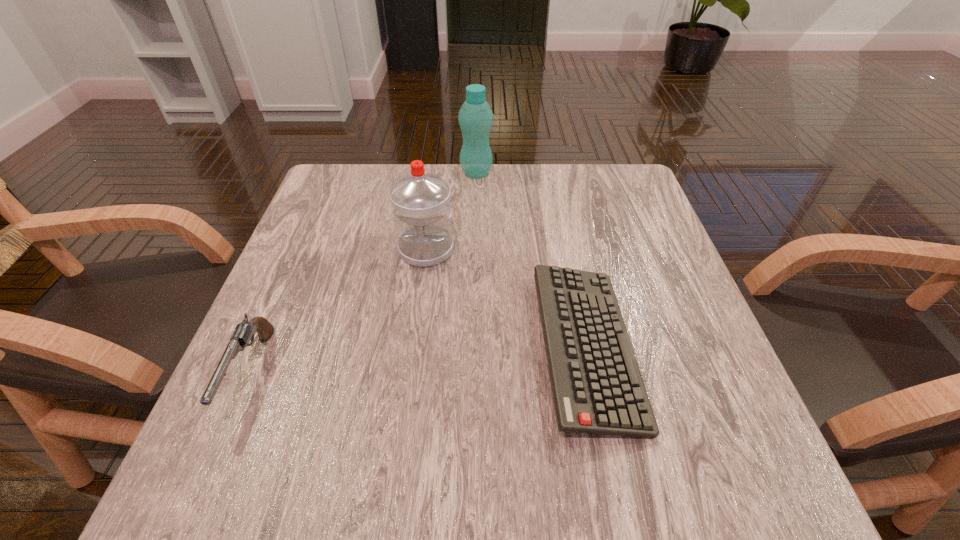
Where is `bottle`? bottle is located at coordinates (475, 117).

The width and height of the screenshot is (960, 540). What are the coordinates of `the farthest object` in the screenshot? It's located at (475, 117).

In order to click on the third object from right to left in this screenshot , I will do pyautogui.click(x=422, y=213).

I want to click on water bottle, so click(x=422, y=213).

Locate an element on the screen. This screenshot has height=540, width=960. the second shortest object is located at coordinates (244, 332).

Identify the location of the leftmost object. The width and height of the screenshot is (960, 540). (244, 332).

You are a GUI agent. You are given a task and a screenshot of the screen. Output one action in this format:
    pyautogui.click(x=<x>, y=<y>)
    Task: Click on the computer keyboard
    Image resolution: width=960 pixels, height=540 pixels.
    Given the screenshot: What is the action you would take?
    pyautogui.click(x=597, y=387)

At what (x,y) coordinates should I click in order to perform the action: click on the rightmost object. Please return your answer as a coordinate pair (x, y). The height and width of the screenshot is (540, 960). Looking at the image, I should click on (597, 387).

This screenshot has width=960, height=540. What are the coordinates of `vacant space situated on the right of the bottle` in the screenshot? It's located at (570, 173).

Identify the location of vacant area located on the handle side of the third nearest object. The image size is (960, 540). (406, 403).